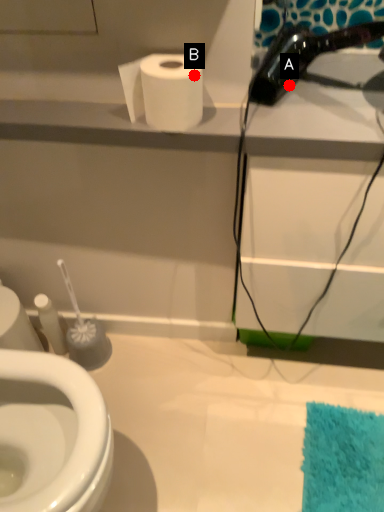
Question: Two points are circled on the image, labeled by A and B beside each circle. Which point appears closest to the camera in this image?

Choices:
 (A) A is closer
 (B) B is closer

Answer: (B)